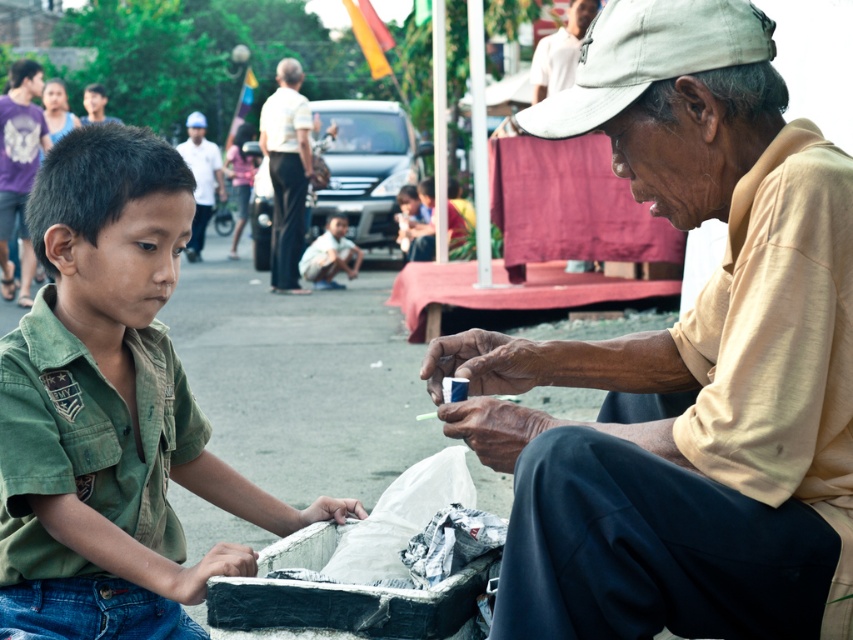
Question: Does light beige cotton shirt at right appear on the right side of white cotton shirt at upper center?

Choices:
 (A) no
 (B) yes

Answer: (B)

Question: Which object is farther from the camera taking this photo?

Choices:
 (A) white cotton shirt at upper center
 (B) green matte shirt at left
 (C) light beige cotton shirt at right

Answer: (A)

Question: Observing the image, what is the correct spatial positioning of light beige cotton shirt at right in reference to green matte shirt at left?

Choices:
 (A) below
 (B) above

Answer: (B)

Question: Which point appears closest to the camera in this image?

Choices:
 (A) (567, 538)
 (B) (277, 83)

Answer: (A)

Question: Among these objects, which one is farthest from the camera?

Choices:
 (A) light beige cotton shirt at right
 (B) white cotton shirt at upper center

Answer: (B)

Question: Can you confirm if light beige cotton shirt at right is thinner than white cotton shirt at upper center?

Choices:
 (A) yes
 (B) no

Answer: (B)